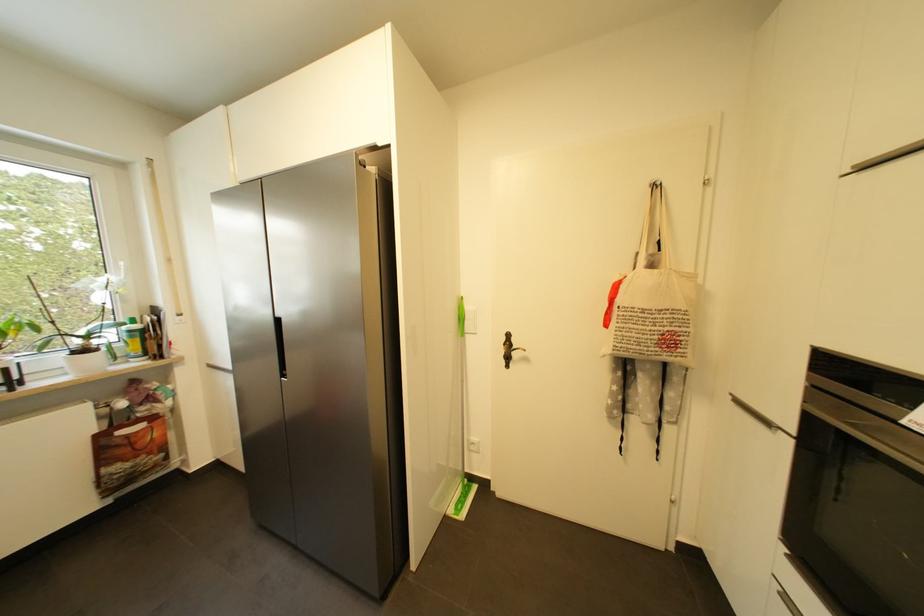
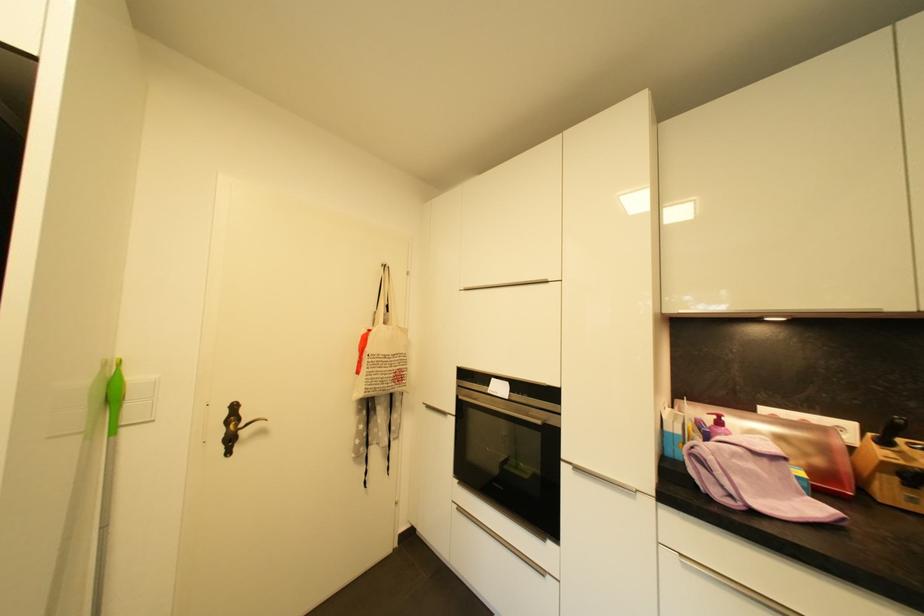
The point at (472, 310) is marked in the first image. Where is the corresponding point in the second image?

(138, 379)